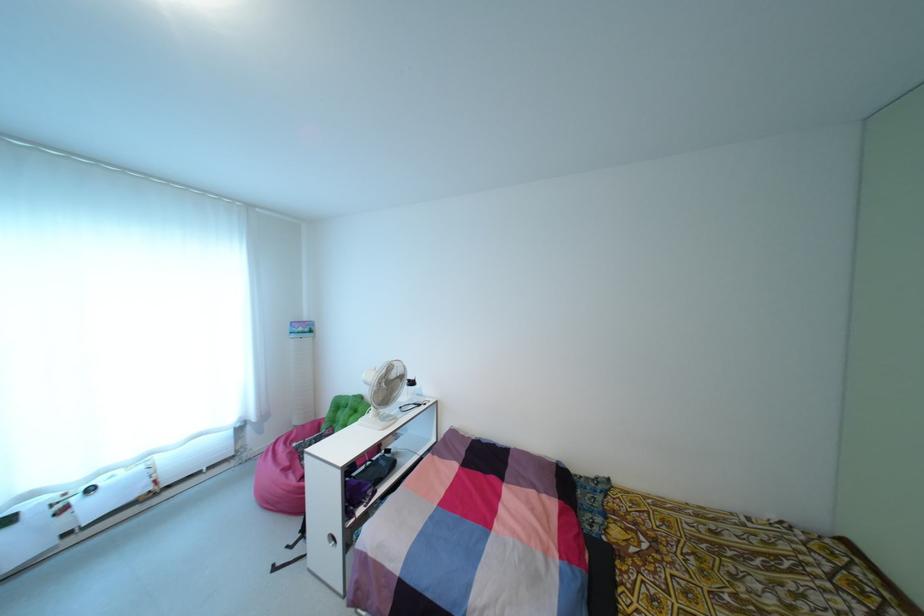
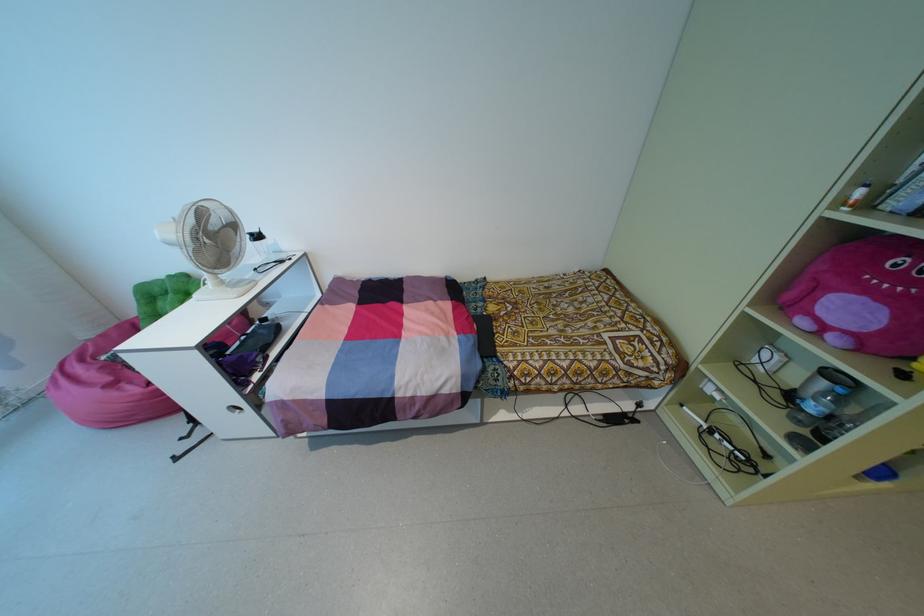
In the scene shown: The images are taken continuously from a first-person perspective. In which direction is your viewpoint rotating?

The camera's rotation is toward right-down.